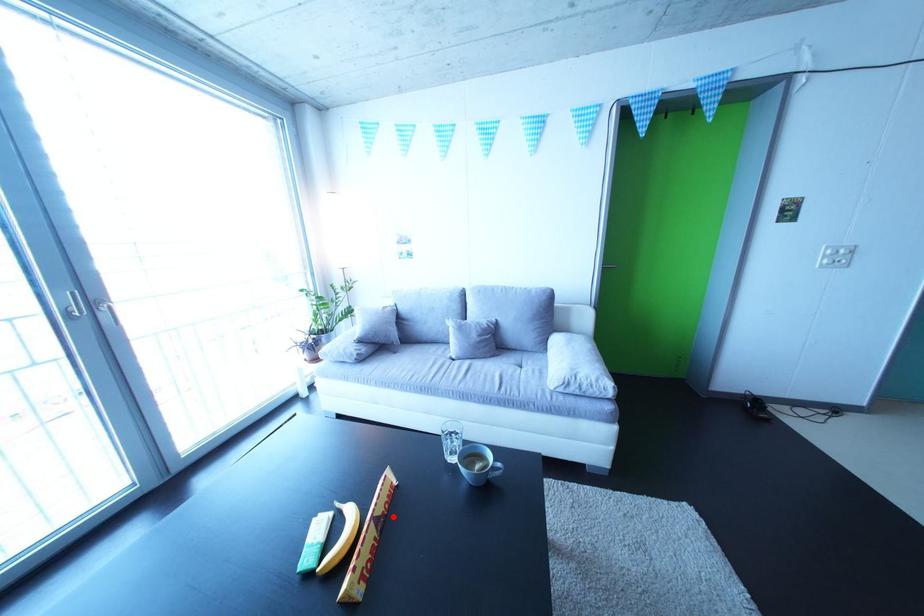
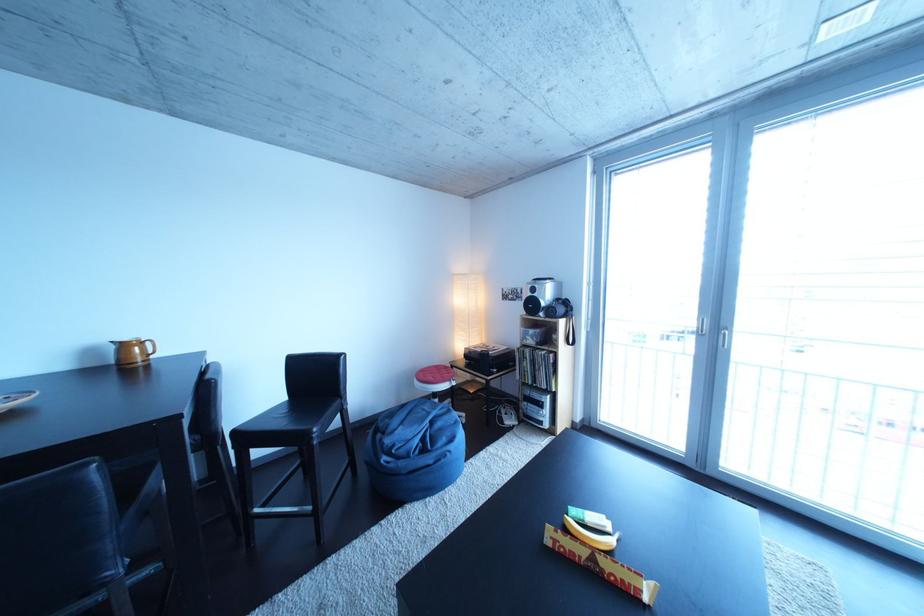
Find the pixel in the second image that matches the highlighted location in the first image.

(617, 570)